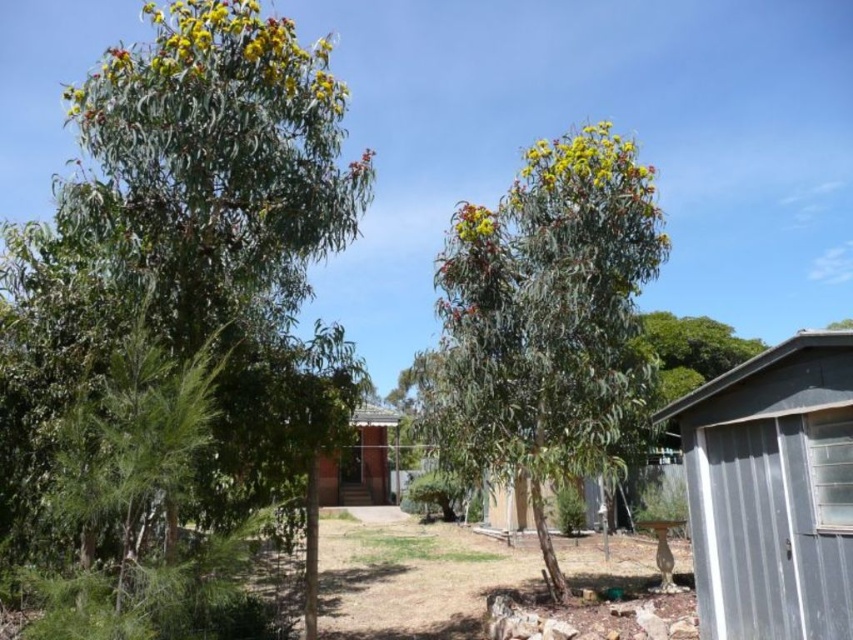
You are standing at the edge of the suburban scene and want to place a 2.5 meter wide picnic blanket between the green glossy tree at center and the green leafy tree at center. Will there be enough space between them to fit the blanket?

The distance between the green glossy tree at center and the green leafy tree at center is 3.53 meters, which is wider than the 2.5 meter picnic blanket. Therefore, the blanket can be placed between them with sufficient space.

You are a gardener planning to plant a new flower bed between the green glossy tree at center and the metallic gray shed at lower right. Based on their positions, which object should you place the flower bed closer to in order to ensure it is in the midground of the image?

The flower bed should be placed closer to the metallic gray shed at lower right because the green glossy tree at center is located above it, meaning the shed is lower in the image and thus closer to the midground.